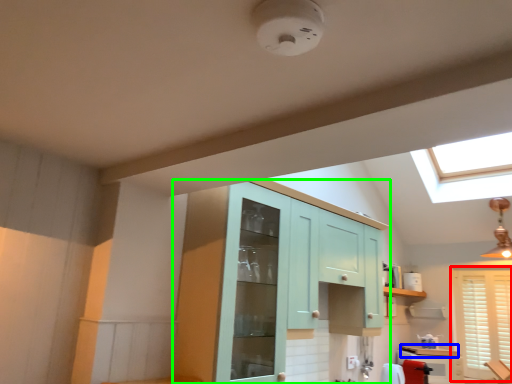
Question: Which is farther away from window (highlighted by a red box)? counter top (highlighted by a blue box) or cabinetry (highlighted by a green box)?

Choices:
 (A) counter top
 (B) cabinetry

Answer: (B)